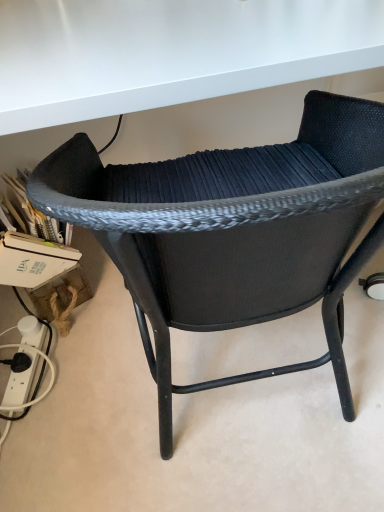
Question: From the image's perspective, would you say black plastic plug at lower left is shown under black woven chair at center?

Choices:
 (A) yes
 (B) no

Answer: (A)

Question: Is black plastic plug at lower left not within black woven chair at center?

Choices:
 (A) no
 (B) yes

Answer: (B)

Question: From a real-world perspective, is black plastic plug at lower left on top of black woven chair at center?

Choices:
 (A) no
 (B) yes

Answer: (A)

Question: Is black plastic plug at lower left not close to black woven chair at center?

Choices:
 (A) no
 (B) yes

Answer: (A)

Question: Considering the relative positions of black plastic plug at lower left and black woven chair at center in the image provided, is black plastic plug at lower left to the right of black woven chair at center from the viewer's perspective?

Choices:
 (A) yes
 (B) no

Answer: (B)

Question: Considering the relative sizes of black plastic plug at lower left and black woven chair at center in the image provided, is black plastic plug at lower left thinner than black woven chair at center?

Choices:
 (A) yes
 (B) no

Answer: (A)

Question: Considering the relative sizes of black woven chair at center and black plastic plug at lower left in the image provided, is black woven chair at center wider than black plastic plug at lower left?

Choices:
 (A) no
 (B) yes

Answer: (B)

Question: Does black woven chair at center come behind black plastic plug at lower left?

Choices:
 (A) no
 (B) yes

Answer: (A)

Question: Can you confirm if black woven chair at center is positioned to the left of black plastic plug at lower left?

Choices:
 (A) yes
 (B) no

Answer: (B)

Question: From the image's perspective, is black woven chair at center under black plastic plug at lower left?

Choices:
 (A) no
 (B) yes

Answer: (A)

Question: Could you tell me if black woven chair at center is facing black plastic plug at lower left?

Choices:
 (A) no
 (B) yes

Answer: (A)

Question: Is black woven chair at center facing away from black plastic plug at lower left?

Choices:
 (A) yes
 (B) no

Answer: (B)

Question: Is point (13, 375) positioned closer to the camera than point (76, 179)?

Choices:
 (A) farther
 (B) closer

Answer: (A)